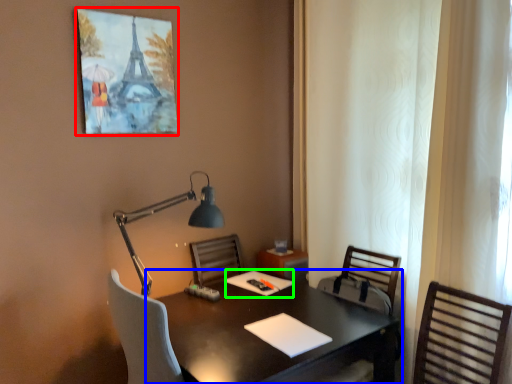
Question: Based on their relative distances, which object is farther from picture frame (highlighted by a red box)? Choose from desk (highlighted by a blue box) and notepad (highlighted by a green box).

Choices:
 (A) desk
 (B) notepad

Answer: (B)